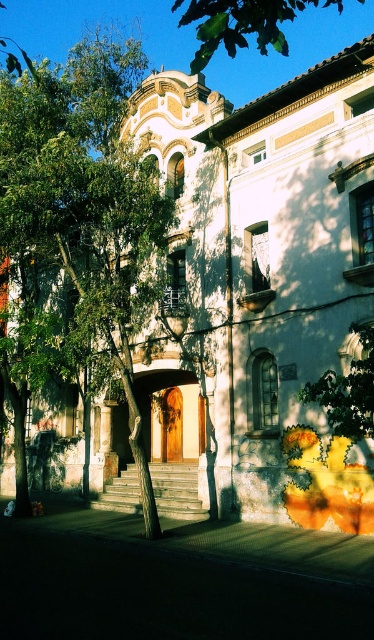
You are standing in front of the historic building and notice two green leafy trees. Which tree has a smaller width, the green leafy tree at center or the green leafy tree at upper center?

Answer: The green leafy tree at center is thinner than the green leafy tree at upper center, so the green leafy tree at center has a smaller width.